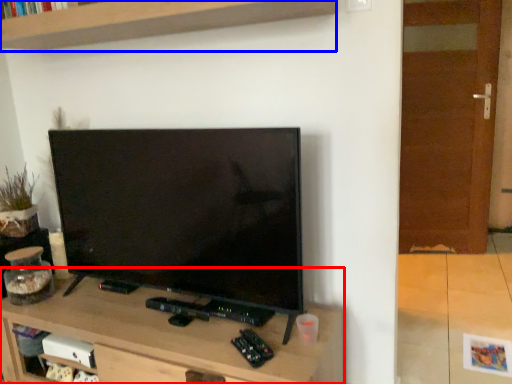
Question: Which object is further to the camera taking this photo, table (highlighted by a red box) or shelf (highlighted by a blue box)?

Choices:
 (A) table
 (B) shelf

Answer: (A)